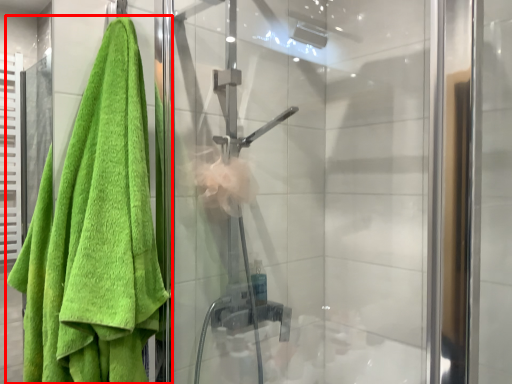
Question: From the image's perspective, where is towel (annotated by the red box) located in relation to screen door in the image?

Choices:
 (A) below
 (B) above

Answer: (A)